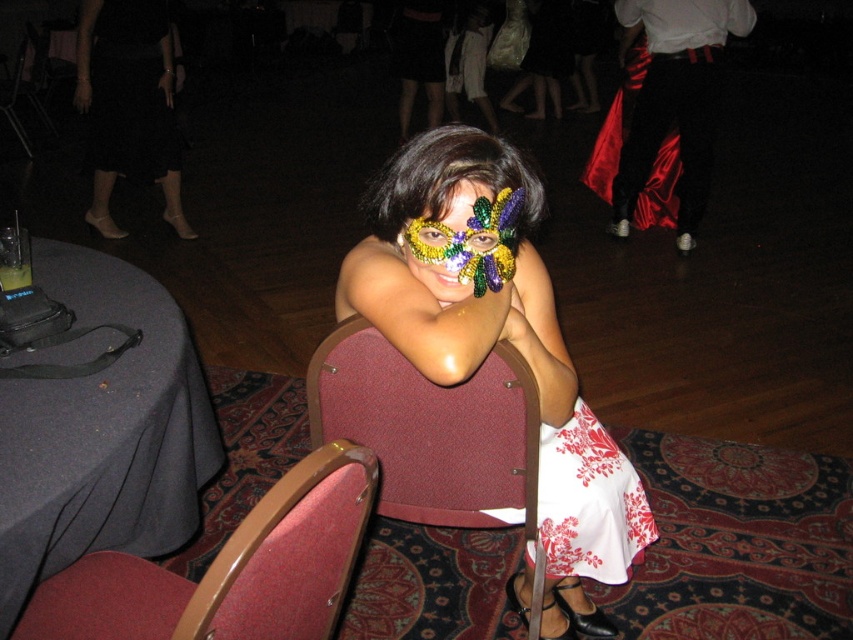
Does velvet red chair at lower left appear on the right side of black satin dress at upper left?

Yes, velvet red chair at lower left is to the right of black satin dress at upper left.

Between velvet red chair at lower left and black satin dress at upper left, which one has more height?

black satin dress at upper left

Is point (273, 596) closer to camera compared to point (102, 77)?

Yes, it is in front of point (102, 77).

At what (x,y) coordinates should I click in order to perform the action: click on velvet red chair at lower left. Please return your answer as a coordinate pair (x, y). Looking at the image, I should click on (229, 568).

Can you confirm if black fabric table at lower left is positioned above shiny sequined mask at center?

No, black fabric table at lower left is not above shiny sequined mask at center.

Where is `black fabric table at lower left`? black fabric table at lower left is located at coordinates (102, 433).

Is maroon fabric chair at center below shiny sequined mask at center?

Yes, maroon fabric chair at center is below shiny sequined mask at center.

In the scene shown: Who is higher up, maroon fabric chair at center or shiny sequined mask at center?

Positioned higher is shiny sequined mask at center.

Is point (534, 568) closer to camera compared to point (405, 240)?

No.

This screenshot has height=640, width=853. Identify the location of maroon fabric chair at center. (433, 433).